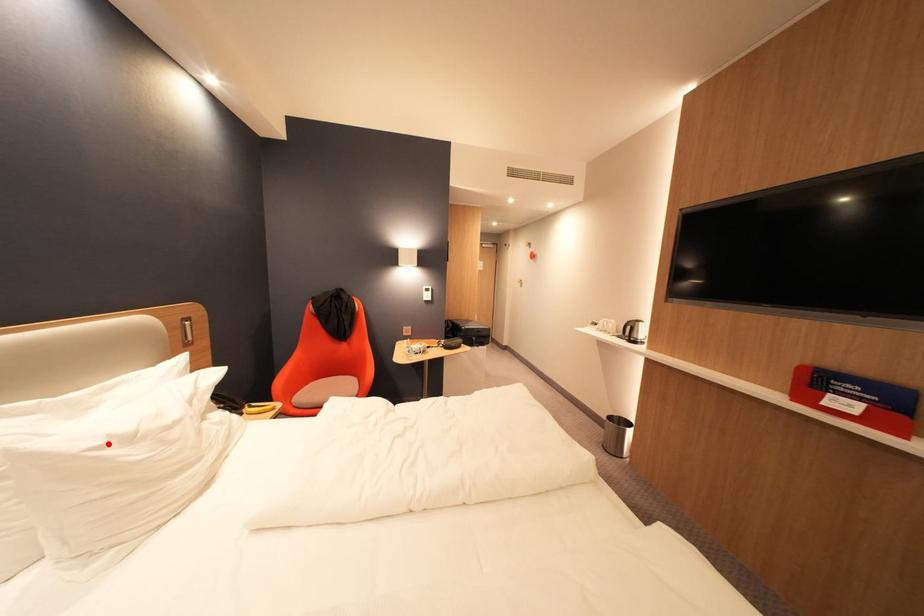
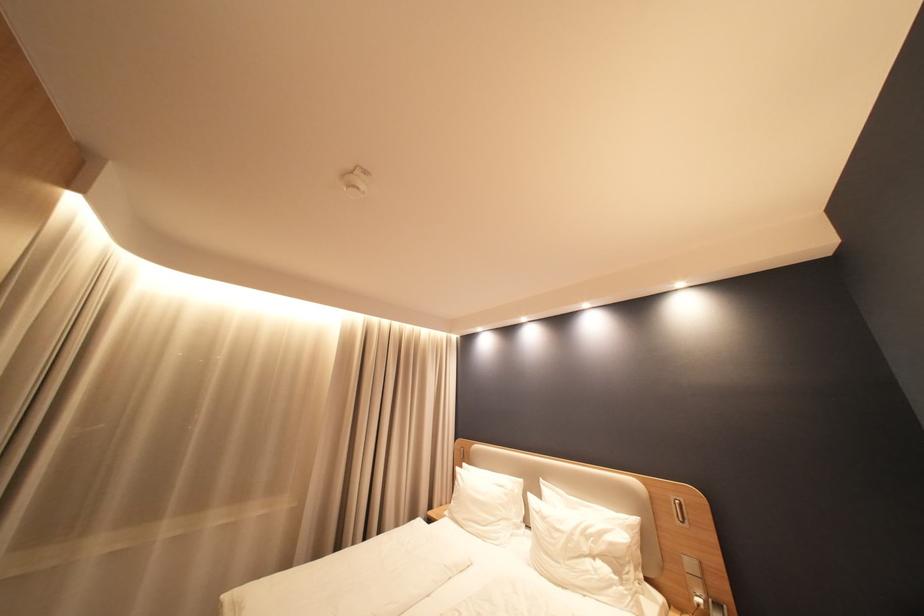
Question: A red point is marked in image1. In image2, is the corresponding 3D point closer to the camera or farther? Reply with the corresponding letter.

Choices:
 (A) The corresponding 3D point is closer.
 (B) The corresponding 3D point is farther.

Answer: (B)